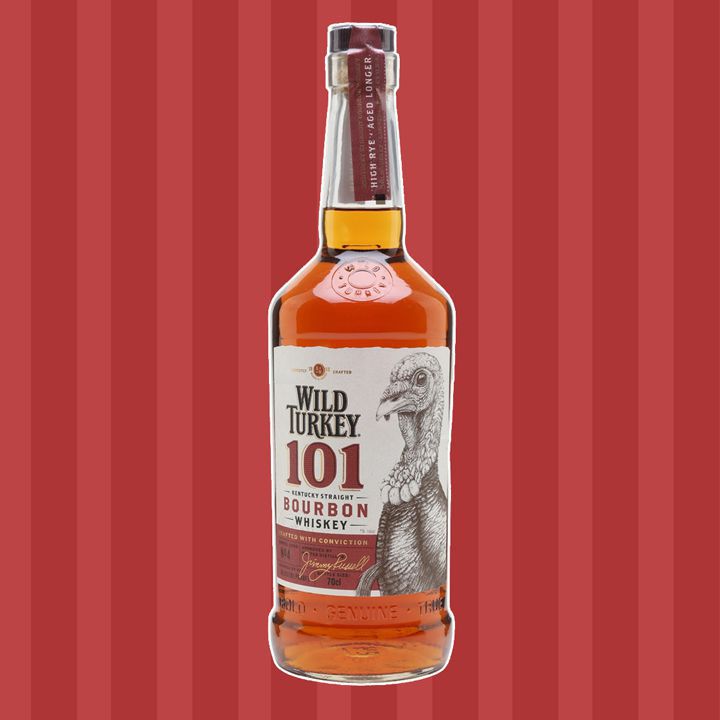
Locate an element on the screen. The height and width of the screenshot is (720, 720). bottle of whiskey is located at coordinates (418, 324).